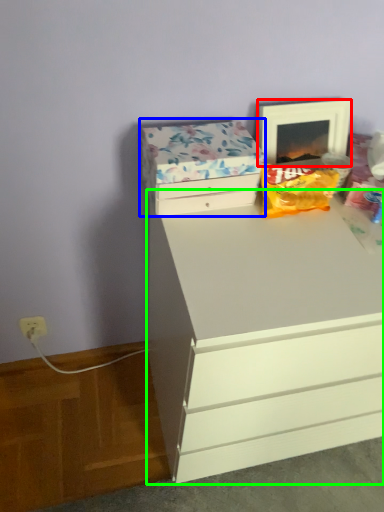
Question: Estimate the real-world distances between objects in this image. Which object is farther from picture frame (highlighted by a red box), storage box (highlighted by a blue box) or chest of drawers (highlighted by a green box)?

Choices:
 (A) storage box
 (B) chest of drawers

Answer: (B)